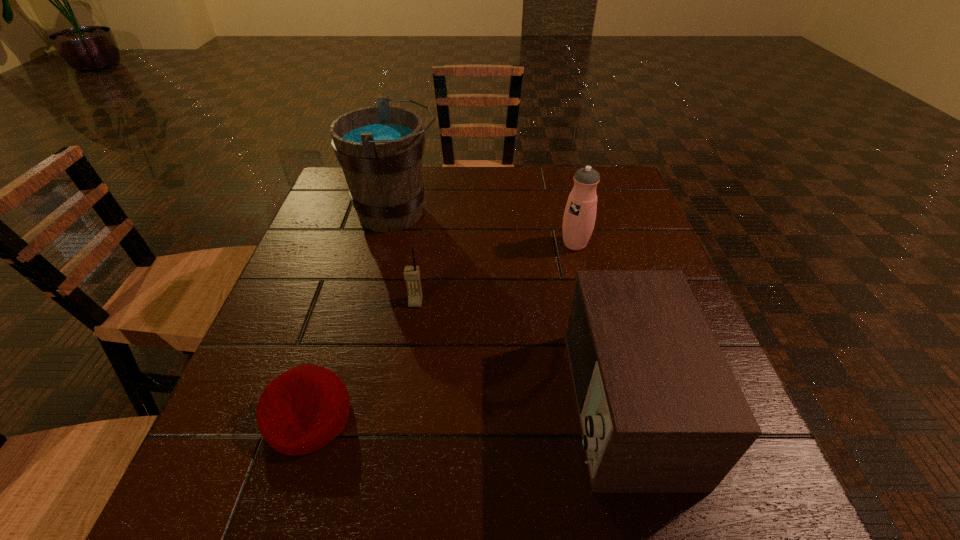
Identify the location of the tallest object. coord(380,148).

In order to click on thermos bottle in this screenshot , I will do `click(579, 218)`.

Identify the location of radio receiver. (660, 410).

Where is `the third nearest object`? the third nearest object is located at coordinates (411, 273).

Find the location of a particular element. This screenshot has height=540, width=960. the second shortest object is located at coordinates (411, 273).

Image resolution: width=960 pixels, height=540 pixels. Find the location of `the shortest object`. the shortest object is located at coordinates (302, 410).

This screenshot has width=960, height=540. What are the coordinates of `vacant space located with a handle on the side of the tallest object` in the screenshot? It's located at (476, 213).

What are the coordinates of `blank space located on the left of the thermos bottle` in the screenshot? It's located at (493, 244).

Where is `vacant space situated 0.140m on the front-facing side of the radio receiver`? The width and height of the screenshot is (960, 540). vacant space situated 0.140m on the front-facing side of the radio receiver is located at coordinates (482, 404).

Image resolution: width=960 pixels, height=540 pixels. What are the coordinates of `free space located on the front-facing side of the radio receiver` in the screenshot? It's located at (500, 404).